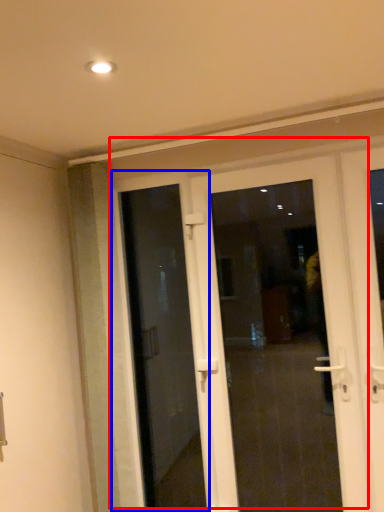
Question: Among these objects, which one is nearest to the camera, door (highlighted by a red box) or door (highlighted by a blue box)?

Choices:
 (A) door
 (B) door

Answer: (A)